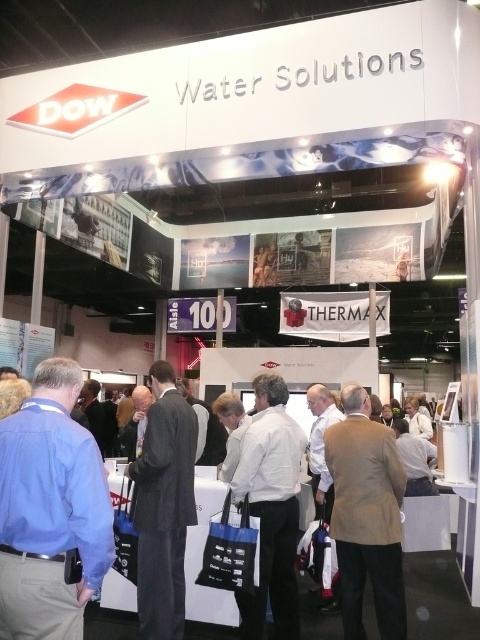
Does blue shirt at left have a greater height compared to tan fabric jacket at center?

No, blue shirt at left is not taller than tan fabric jacket at center.

Can you confirm if blue shirt at left is shorter than tan fabric jacket at center?

Indeed, blue shirt at left has a lesser height compared to tan fabric jacket at center.

The width and height of the screenshot is (480, 640). I want to click on blue shirt at left, so click(49, 509).

Consider the image. Can you confirm if tan fabric jacket at center is smaller than dark gray suit at center?

Indeed, tan fabric jacket at center has a smaller size compared to dark gray suit at center.

Locate an element on the screen. This screenshot has height=640, width=480. tan fabric jacket at center is located at coordinates (367, 516).

Can you confirm if blue shirt at left is positioned to the right of white matte shirt at center?

No, blue shirt at left is not to the right of white matte shirt at center.

Measure the distance from blue shirt at left to white matte shirt at center.

Answer: blue shirt at left and white matte shirt at center are 1.25 meters apart.

Is point (27, 566) positioned in front of point (256, 449)?

Yes.

I want to click on blue shirt at left, so click(x=49, y=509).